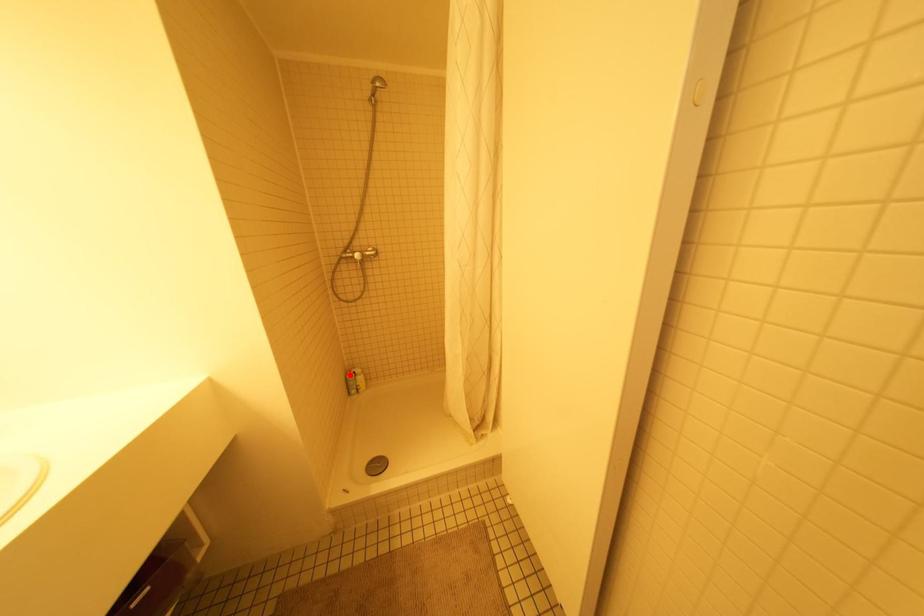
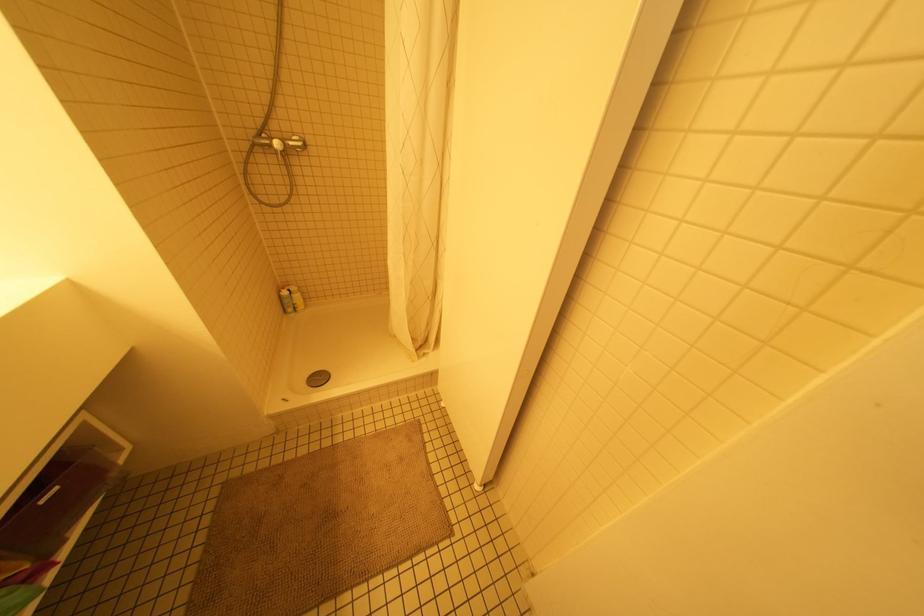
Question: I am providing you with two images of the same scene from different viewpoints. Given a red point in image1, look at the same physical point in image2. Is it:

Choices:
 (A) Closer to the viewpoint
 (B) Farther from the viewpoint

Answer: (A)